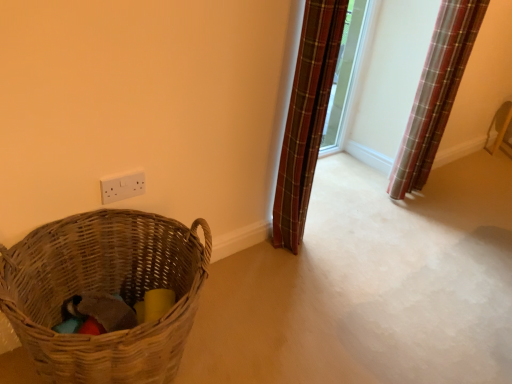
Question: Considering the relative sizes of white plastic electric outlet at upper center and woven brown basket at lower left in the image provided, is white plastic electric outlet at upper center shorter than woven brown basket at lower left?

Choices:
 (A) yes
 (B) no

Answer: (A)

Question: Is woven brown basket at lower left located within white plastic electric outlet at upper center?

Choices:
 (A) yes
 (B) no

Answer: (B)

Question: Is white plastic electric outlet at upper center bigger than woven brown basket at lower left?

Choices:
 (A) no
 (B) yes

Answer: (A)

Question: Would you say white plastic electric outlet at upper center is a long distance from woven brown basket at lower left?

Choices:
 (A) no
 (B) yes

Answer: (A)

Question: Is white plastic electric outlet at upper center further to the viewer compared to woven brown basket at lower left?

Choices:
 (A) yes
 (B) no

Answer: (A)

Question: Is white plastic electric outlet at upper center facing away from woven brown basket at lower left?

Choices:
 (A) yes
 (B) no

Answer: (B)

Question: From the image's perspective, is white plastic electric outlet at upper center over plaid fabric curtain at upper right, which is the second curtain in right-to-left order?

Choices:
 (A) no
 (B) yes

Answer: (A)

Question: Is white plastic electric outlet at upper center positioned beyond the bounds of plaid fabric curtain at upper right, marked as the first curtain in a left-to-right arrangement?

Choices:
 (A) no
 (B) yes

Answer: (B)

Question: Does white plastic electric outlet at upper center appear on the right side of plaid fabric curtain at upper right, which is the second curtain in right-to-left order?

Choices:
 (A) yes
 (B) no

Answer: (B)

Question: Is white plastic electric outlet at upper center not near plaid fabric curtain at upper right, marked as the first curtain in a left-to-right arrangement?

Choices:
 (A) no
 (B) yes

Answer: (A)

Question: Considering the relative sizes of white plastic electric outlet at upper center and plaid fabric curtain at upper right, marked as the first curtain in a left-to-right arrangement, in the image provided, is white plastic electric outlet at upper center taller than plaid fabric curtain at upper right, marked as the first curtain in a left-to-right arrangement,?

Choices:
 (A) no
 (B) yes

Answer: (A)

Question: From a real-world perspective, is white plastic electric outlet at upper center positioned under plaid fabric curtain at upper right, marked as the first curtain in a left-to-right arrangement, based on gravity?

Choices:
 (A) yes
 (B) no

Answer: (A)

Question: Can you confirm if woven brown basket at lower left is wider than white plastic electric outlet at upper center?

Choices:
 (A) yes
 (B) no

Answer: (A)